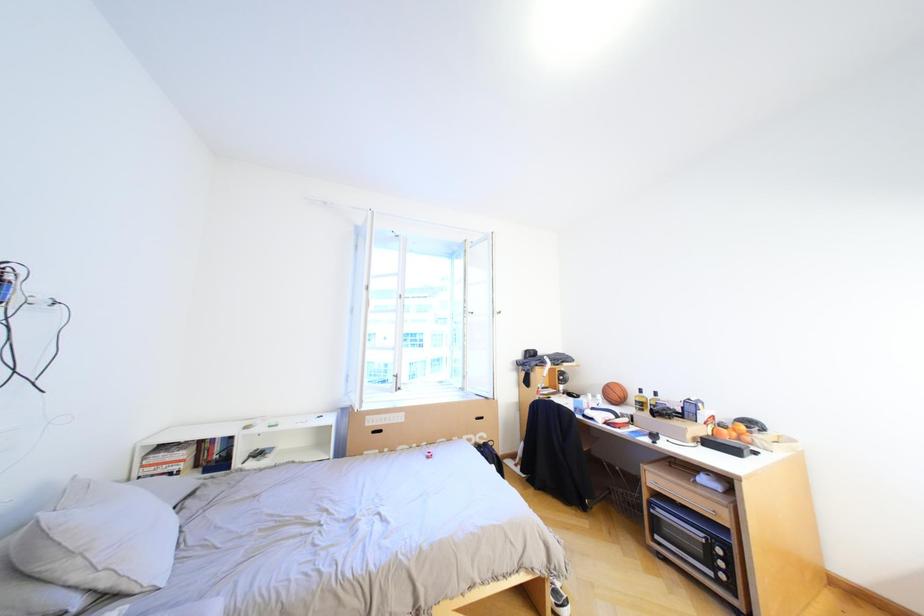
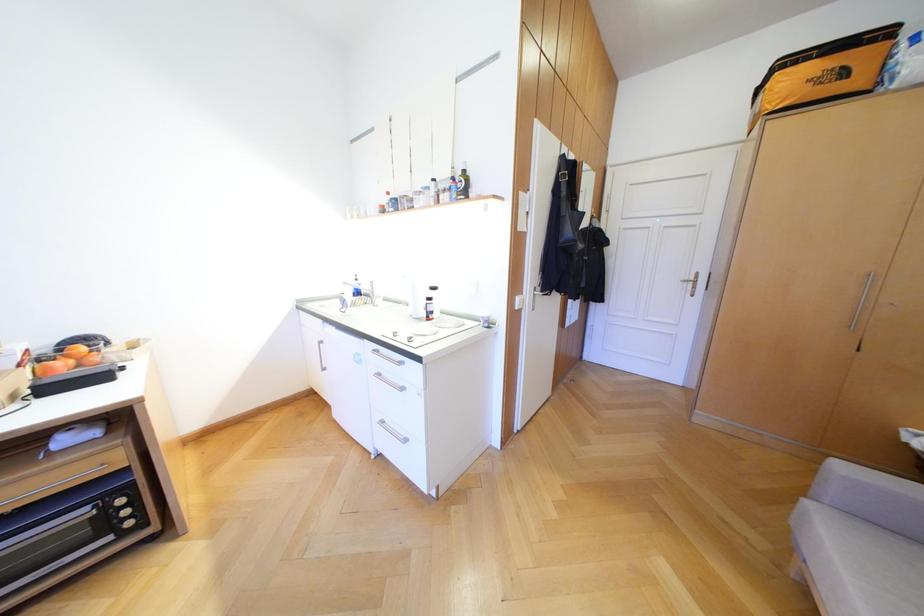
Question: How did the camera likely rotate?

Choices:
 (A) Left
 (B) Right
 (C) Up
 (D) Down

Answer: (B)